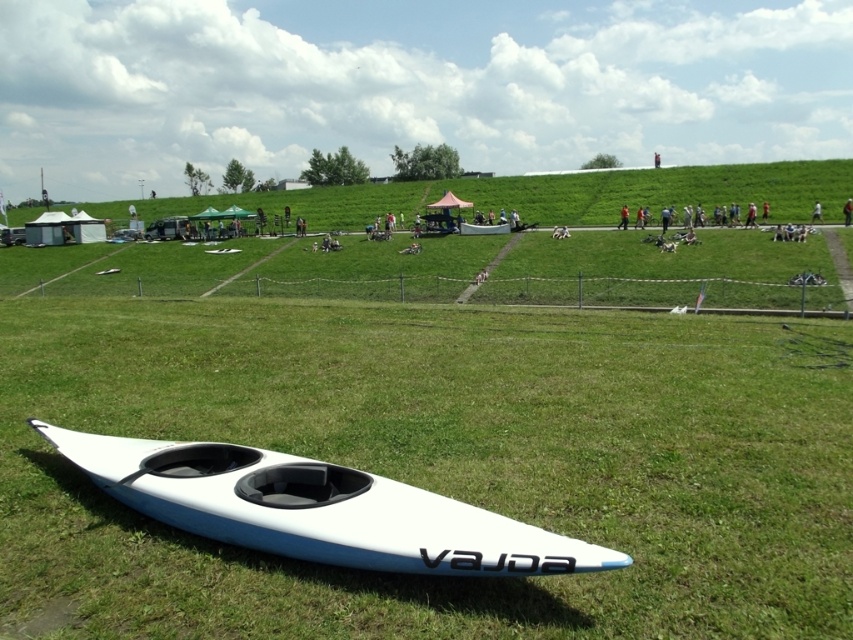
Based on the photo, you are planning to place the blue fabric jacket at center on top of the white matte kayak at lower left. Based on their sizes, will the jacket completely cover the kayak?

The blue fabric jacket at center is not as tall as the white matte kayak at lower left, so the jacket will not completely cover the kayak because it is shorter in height.

From the picture: You are standing near the white kayak with black seats and a blue stripe in the foreground. You see a blue fabric jacket at center and a dark blue fabric person at center. Which object is taller?

The blue fabric jacket at center is taller than the dark blue fabric person at center.

You are planning to set up a tent on the green grassy hillside at upper center and the white matte kayak at lower left. Which location would provide a higher elevation for better visibility of the event area?

The green grassy hillside at upper center is taller than the white matte kayak at lower left, so setting up the tent there would offer a higher elevation for better visibility of the event area.